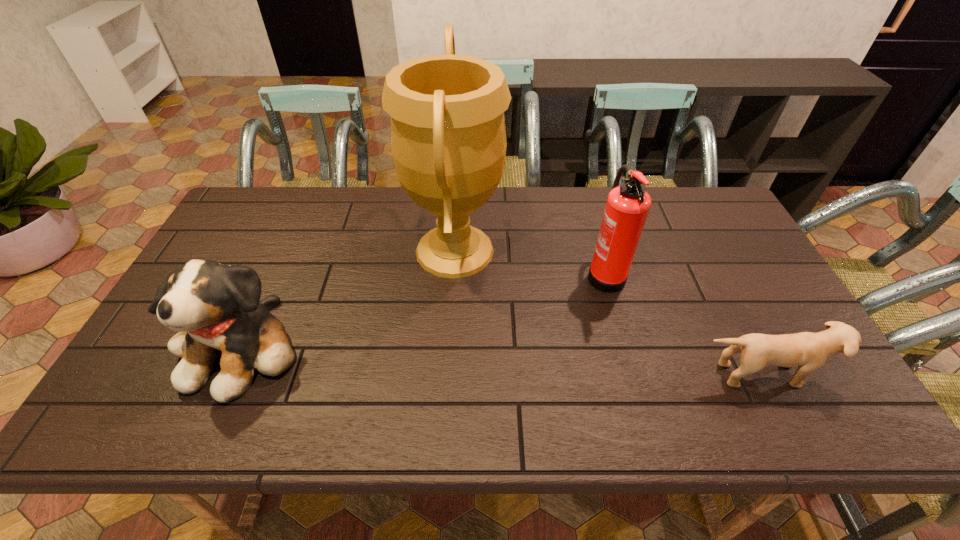
What are the coordinates of `vacant space at the left edge` in the screenshot? It's located at (255, 256).

Where is `free space at the right edge of the desktop`? This screenshot has width=960, height=540. free space at the right edge of the desktop is located at coordinates coord(736,305).

You are a GUI agent. You are given a task and a screenshot of the screen. Output one action in this format:
    pyautogui.click(x=<x>, y=<y>)
    Task: Click on the vacant area between the tallest object and the third shortest object
    
    Given the screenshot: What is the action you would take?
    pyautogui.click(x=530, y=262)

What are the coordinates of `vacant space in between the right puppy and the second tallest object` in the screenshot? It's located at (683, 323).

This screenshot has width=960, height=540. In order to click on free point between the second shortest object and the shorter puppy in this screenshot , I will do `click(501, 361)`.

You are a GUI agent. You are given a task and a screenshot of the screen. Output one action in this format:
    pyautogui.click(x=<x>, y=<y>)
    Task: Click on the empty location between the third object from right to left and the shorter puppy
    
    Given the screenshot: What is the action you would take?
    pyautogui.click(x=608, y=313)

Locate an element on the screen. The width and height of the screenshot is (960, 540). vacant space that's between the rightmost object and the leftmost object is located at coordinates (501, 361).

At what (x,y) coordinates should I click in order to perform the action: click on free space between the third shortest object and the right puppy. Please return your answer as a coordinate pair (x, y). This screenshot has height=540, width=960. Looking at the image, I should click on (683, 323).

Where is `empty space between the third object from right to left and the fire extinguisher`? This screenshot has height=540, width=960. empty space between the third object from right to left and the fire extinguisher is located at coordinates (530, 262).

The width and height of the screenshot is (960, 540). I want to click on vacant area between the second object from right to left and the right puppy, so click(x=683, y=323).